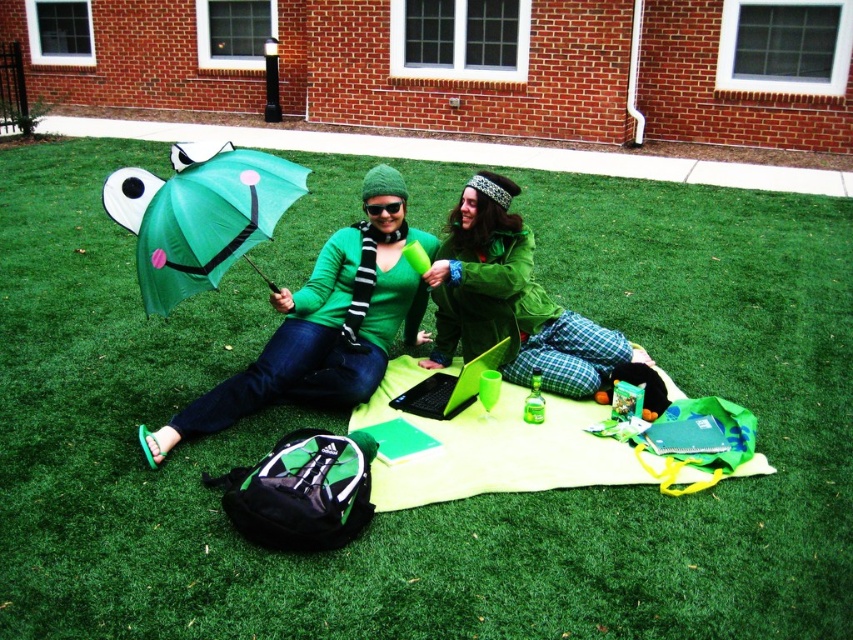
You are planning to sit under one of the umbrellas in the image. Which umbrella would provide more shade coverage, the matte green umbrella at upper left or the matte green umbrella at center?

The matte green umbrella at upper left might be wider than the matte green umbrella at center, so it could provide more shade coverage.

You are standing in front of the brick building and want to take a photo of the green fuzzy jacket at center and the matte green umbrella at center. Which object will appear larger in the photo?

The green fuzzy jacket at center will appear larger in the photo because it is closer to you than the matte green umbrella at center.